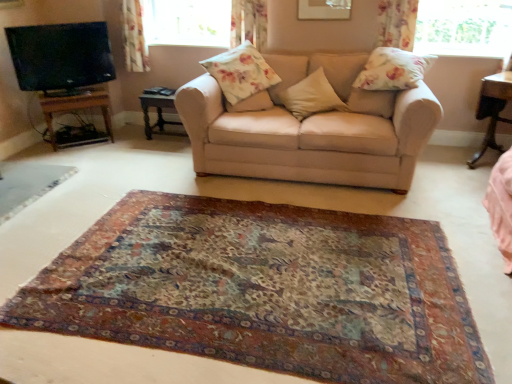
Locate an element on the screen. The height and width of the screenshot is (384, 512). vacant region in front of wooden table at left, which is counted as the second table, starting from the right is located at coordinates (163, 147).